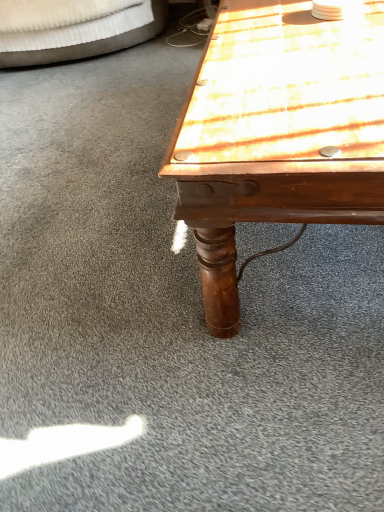
You are a GUI agent. You are given a task and a screenshot of the screen. Output one action in this format:
    pyautogui.click(x=<x>, y=<y>)
    Task: Click on the wooden table at center
    This screenshot has height=512, width=384.
    Given the screenshot: What is the action you would take?
    pyautogui.click(x=278, y=132)

This screenshot has width=384, height=512. What do you see at coordinates (278, 132) in the screenshot?
I see `wooden table at center` at bounding box center [278, 132].

This screenshot has height=512, width=384. I want to click on wooden table at center, so click(278, 132).